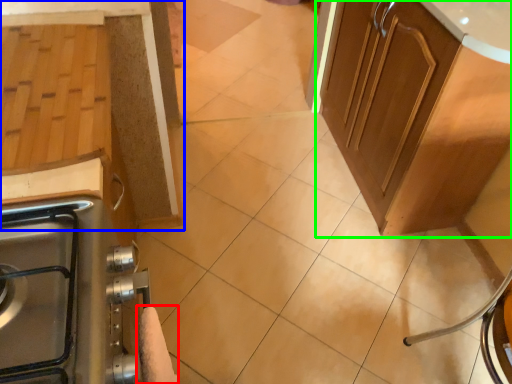
Question: Which object is positioned closest to hand towel (highlighted by a red box)? Select from cabinetry (highlighted by a blue box) and cabinetry (highlighted by a green box).

Choices:
 (A) cabinetry
 (B) cabinetry

Answer: (A)